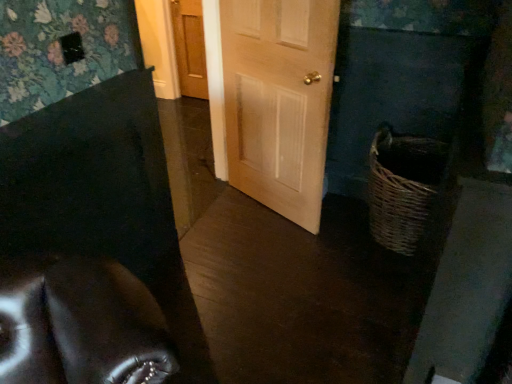
Find the location of `free space in front of woven brown basket at lower right`. free space in front of woven brown basket at lower right is located at coordinates (371, 286).